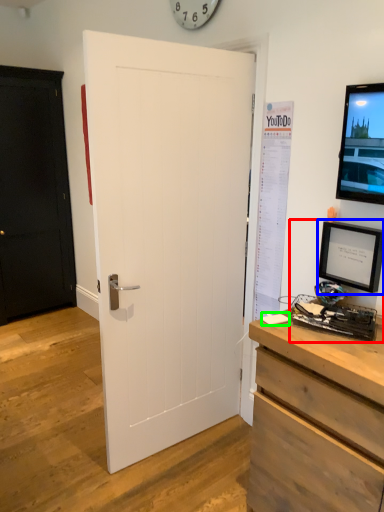
Question: Based on their relative distances, which object is nearer to desktop computer (highlighted by a red box)? Choose from picture frame (highlighted by a blue box) and notepad (highlighted by a green box).

Choices:
 (A) picture frame
 (B) notepad

Answer: (A)